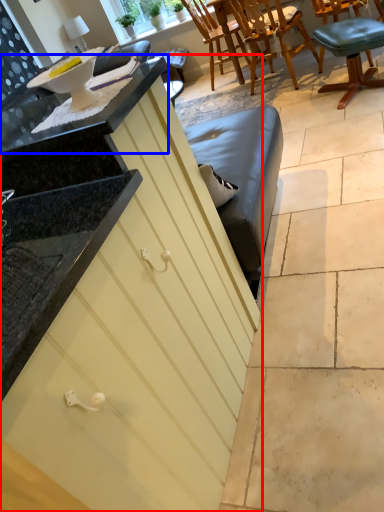
Question: Which object appears closest to the camera in this image, cabinetry (highlighted by a red box) or countertop (highlighted by a blue box)?

Choices:
 (A) cabinetry
 (B) countertop

Answer: (A)